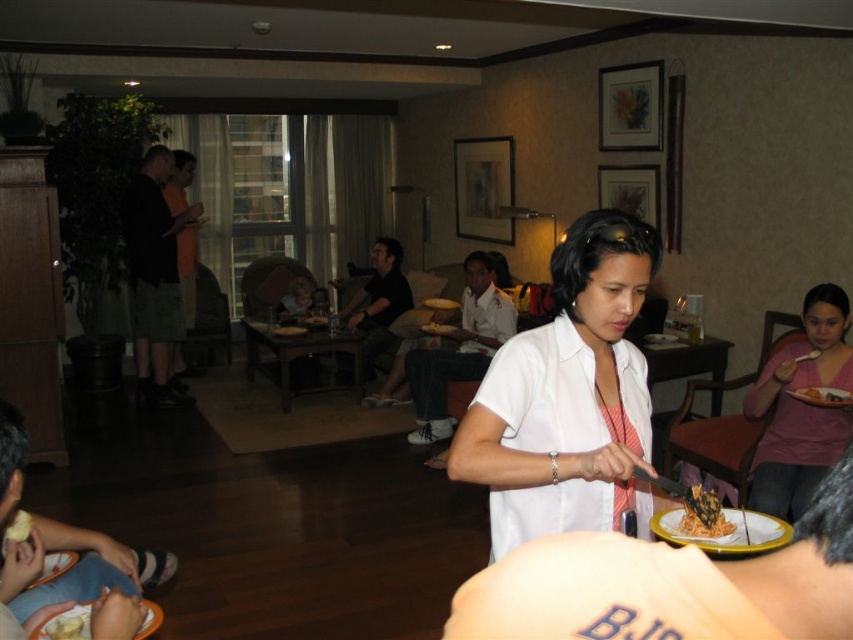
You are a guest at this event and need to place your white matte plate at right on top of the white matte shirt at center. Is this possible based on their sizes?

The white matte shirt at center has a greater height compared to the white matte plate at right, so placing the plate on top of the shirt is possible since the shirt is taller.

You are a guest at this event and want to hand a gift to the person wearing the white matte shirt at center. However, you also notice the pink matte shirt at lower right nearby. Which shirt should you approach to ensure you reach the correct person first?

The white matte shirt at center is smaller than the pink matte shirt at lower right, so you should approach the white matte shirt at center to ensure you reach the correct person first since it is closer to you.